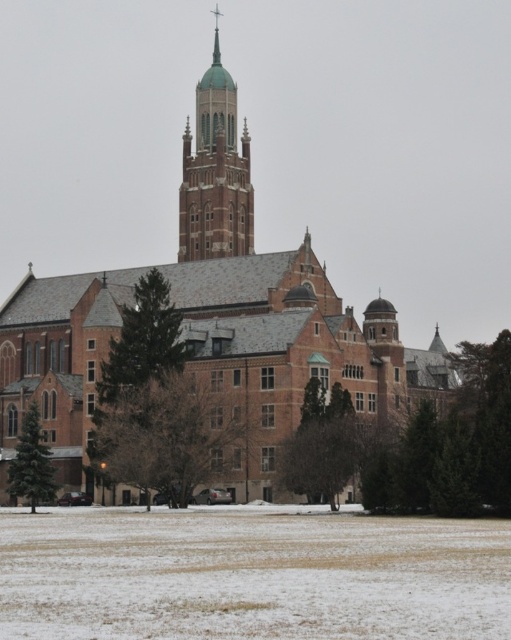
Question: Considering the relative positions of green textured tree at center and green-tiled spire at center in the image provided, where is green textured tree at center located with respect to green-tiled spire at center?

Choices:
 (A) below
 (B) above

Answer: (A)

Question: Can you confirm if brick church at center is bigger than green textured tree at center-left?

Choices:
 (A) yes
 (B) no

Answer: (A)

Question: Which is nearer to the brick church at center?

Choices:
 (A) snowy grass at lower center
 (B) green-tiled spire at center
 (C) green textured tree at center-left
 (D) green textured tree at center

Answer: (B)

Question: Which object is positioned farthest from the brick church at center?

Choices:
 (A) green textured tree at center
 (B) snowy grass at lower center

Answer: (B)

Question: Does brick church at center lie in front of green textured tree at center?

Choices:
 (A) no
 (B) yes

Answer: (A)

Question: Which object is closer to the camera taking this photo?

Choices:
 (A) snowy grass at lower center
 (B) green textured tree at center
 (C) bare branches at center

Answer: (A)